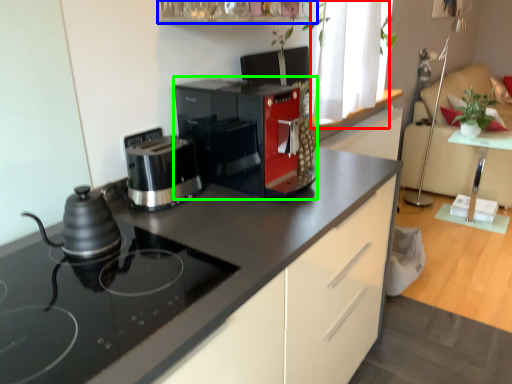
Question: Which is farther away from window (highlighted by a red box)? shelf (highlighted by a blue box) or coffee maker (highlighted by a green box)?

Choices:
 (A) shelf
 (B) coffee maker

Answer: (B)